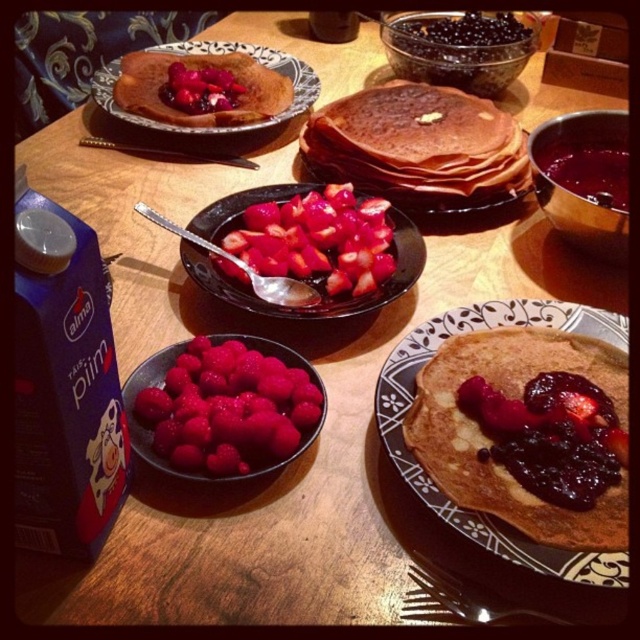
Which is in front, point (246, 381) or point (314, 122)?

Point (246, 381) is more forward.

Is bright red berries at center to the right of brown matte pancake at center from the viewer's perspective?

In fact, bright red berries at center is to the left of brown matte pancake at center.

Is point (144, 413) positioned in front of point (496, 170)?

That is True.

This screenshot has width=640, height=640. What are the coordinates of `bright red berries at center` in the screenshot? It's located at (225, 404).

Between matte brown pancake stack at lower right and matte brown crepe at upper left, which one is positioned lower?

Positioned lower is matte brown pancake stack at lower right.

Which is above, matte brown pancake stack at lower right or matte brown crepe at upper left?

Positioned higher is matte brown crepe at upper left.

Is point (570, 321) farther from camera compared to point (237, 44)?

No, it is not.

The image size is (640, 640). In order to click on matte brown pancake stack at lower right in this screenshot , I will do `click(428, 476)`.

Who is more forward, (269, 444) or (378, 416)?

Point (269, 444) is more forward.

Does bright red berries at center appear under matte brown pancake stack at lower right?

Yes.

The height and width of the screenshot is (640, 640). Identify the location of bright red berries at center. (225, 404).